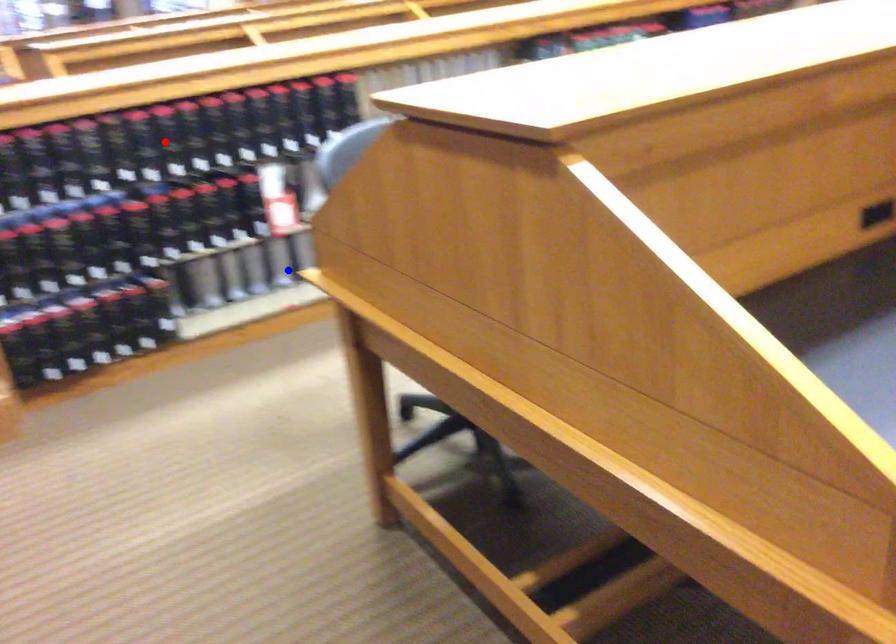
Question: Which of the two points in the image is closer to the camera?

Choices:
 (A) Blue point is closer.
 (B) Red point is closer.

Answer: (B)